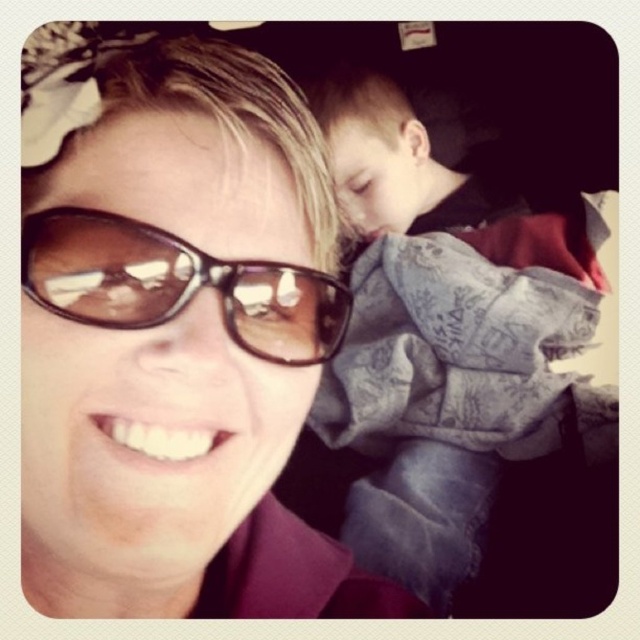
Who is taller, matte brown sunglasses at upper left or sunglasses at center?

matte brown sunglasses at upper left is taller.

Does matte brown sunglasses at upper left have a lesser height compared to sunglasses at center?

Incorrect, matte brown sunglasses at upper left's height does not fall short of sunglasses at center's.

Image resolution: width=640 pixels, height=640 pixels. Find the location of `matte brown sunglasses at upper left`. matte brown sunglasses at upper left is located at coordinates (180, 348).

Which is behind, point (29, 228) or point (524, 385)?

Positioned behind is point (524, 385).

Which is more to the right, matte brown sunglasses at upper left or denim jacket at upper right?

denim jacket at upper right

This screenshot has height=640, width=640. Find the location of `matte brown sunglasses at upper left`. matte brown sunglasses at upper left is located at coordinates (180, 348).

Locate an element on the screen. matte brown sunglasses at upper left is located at coordinates (180, 348).

How far apart are denim jacket at upper right and sunglasses at center?

denim jacket at upper right is 27.75 inches from sunglasses at center.

Which of these two, denim jacket at upper right or sunglasses at center, stands shorter?

Standing shorter between the two is sunglasses at center.

Does point (417, 404) come in front of point (61, 291)?

That is False.

I want to click on denim jacket at upper right, so click(x=448, y=339).